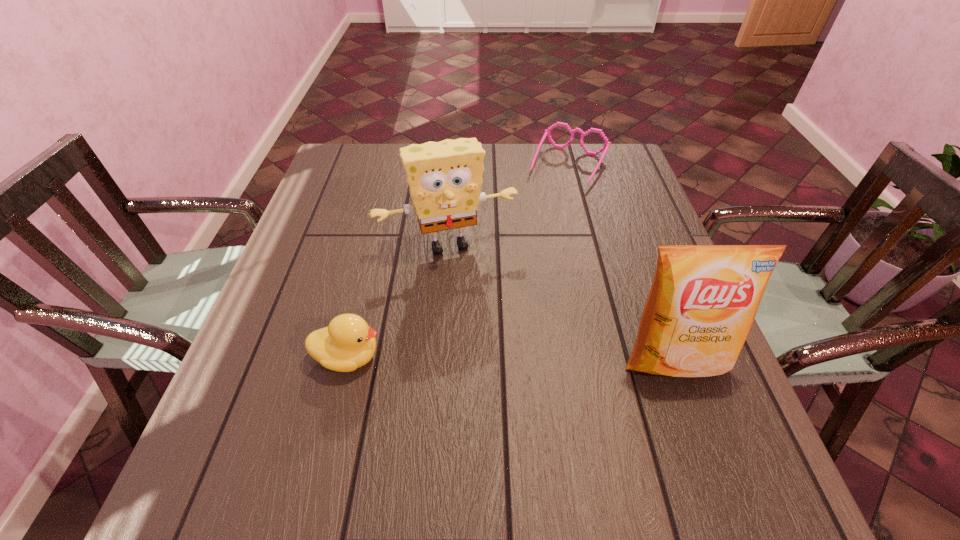
The height and width of the screenshot is (540, 960). I want to click on free space located on the arms of the spectacles, so pyautogui.click(x=510, y=281).

You are a GUI agent. You are given a task and a screenshot of the screen. Output one action in this format:
    pyautogui.click(x=<x>, y=<y>)
    Task: Click on the vacant region located 0.290m on the arms of the spectacles
    This screenshot has width=960, height=540.
    Given the screenshot: What is the action you would take?
    pyautogui.click(x=525, y=251)

You are a GUI agent. You are given a task and a screenshot of the screen. Output one action in this format:
    pyautogui.click(x=<x>, y=<y>)
    Task: Click on the free space located on the arms of the spectacles
    The image size is (960, 540).
    Given the screenshot: What is the action you would take?
    pyautogui.click(x=525, y=251)

Find the location of `object at the far edge`. object at the far edge is located at coordinates (547, 132).

Where is `object present at the left edge`? object present at the left edge is located at coordinates (348, 343).

At what (x,y) coordinates should I click in order to perform the action: click on crisp (potato chip) that is at the right edge. Please return your answer as a coordinate pair (x, y). The width and height of the screenshot is (960, 540). Looking at the image, I should click on (703, 300).

The image size is (960, 540). I want to click on spectacles positioned at the right edge, so click(x=547, y=132).

I want to click on object situated at the far right corner, so click(x=547, y=132).

Identify the location of free space at the far edge. (527, 154).

Where is `free space at the left edge of the desktop`? The width and height of the screenshot is (960, 540). free space at the left edge of the desktop is located at coordinates (281, 282).